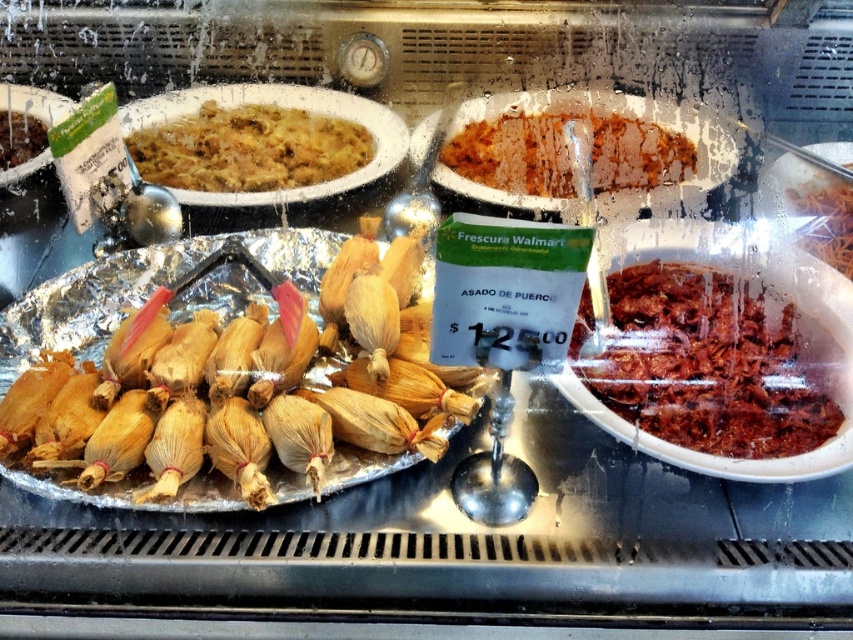
Question: Among these objects, which one is nearest to the camera?

Choices:
 (A) green matte corn husks at upper left
 (B) dark red shredded meat at right
 (C) brown shredded meat at right
 (D) golden corn husks at left

Answer: (D)

Question: Which object is the farthest from the brown crumbly rice at upper center?

Choices:
 (A) golden corn husks at left
 (B) yellowish matte rice at upper left
 (C) brown shredded meat at right
 (D) dark red shredded meat at right

Answer: (A)

Question: Which of the following is the closest to the observer?

Choices:
 (A) (25, 150)
 (B) (834, 253)

Answer: (B)

Question: Does golden corn husks at left have a smaller size compared to yellowish matte rice at upper left?

Choices:
 (A) yes
 (B) no

Answer: (B)

Question: Can you confirm if golden corn husks at left is thinner than brown crumbly rice at upper center?

Choices:
 (A) no
 (B) yes

Answer: (A)

Question: Is yellowish matte rice at upper left thinner than green matte corn husks at upper left?

Choices:
 (A) yes
 (B) no

Answer: (B)